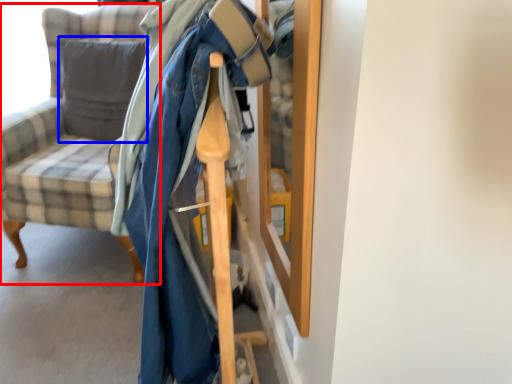
Question: Which object is closer to the camera taking this photo, chair (highlighted by a red box) or pillow (highlighted by a blue box)?

Choices:
 (A) chair
 (B) pillow

Answer: (A)